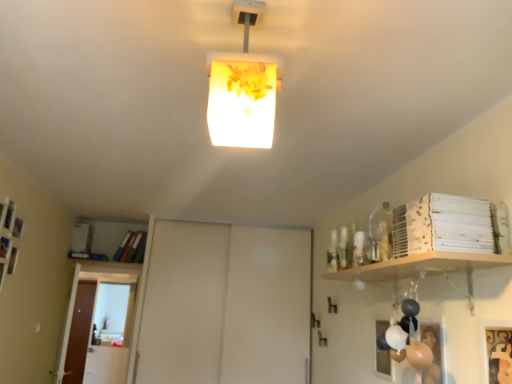
What is the approximate height of white matte sliding door at center, the 2th door from the left?

white matte sliding door at center, the 2th door from the left, is 1.54 meters in height.

Image resolution: width=512 pixels, height=384 pixels. Find the location of `white matte sliding door at center, the 2th door from the left`. white matte sliding door at center, the 2th door from the left is located at coordinates (225, 305).

Locate an element on the screen. The image size is (512, 384). transparent glass door at lower left is located at coordinates [110, 334].

The height and width of the screenshot is (384, 512). Identify the location of gold textured picture frame at lower right. (499, 355).

The width and height of the screenshot is (512, 384). I want to click on white matte sliding door at center, the 2th door from the left, so click(x=225, y=305).

Is translucent floral-patterned lampshade at center shorter than transparent glass door at lower left?

Yes, translucent floral-patterned lampshade at center is shorter than transparent glass door at lower left.

Consider the image. Which of these two, translucent floral-patterned lampshade at center or transparent glass door at lower left, is bigger?

transparent glass door at lower left is bigger.

Looking at this image, is translucent floral-patterned lampshade at center oriented away from transparent glass door at lower left?

No, translucent floral-patterned lampshade at center is not facing the opposite direction of transparent glass door at lower left.

In terms of width, does translucent floral-patterned lampshade at center look wider or thinner when compared to transparent glass door at lower left?

In the image, translucent floral-patterned lampshade at center appears to be wider than transparent glass door at lower left.

Is point (272, 271) in front of point (105, 299)?

Yes, point (272, 271) is in front of point (105, 299).

Is white matte sliding door at center, the 2th door from the left, completely or partially outside of transparent glass door at lower left?

Yes, white matte sliding door at center, the 2th door from the left, is not within transparent glass door at lower left.

Based on the photo, which of these two, white matte sliding door at center, marked as the second door in a back-to-front arrangement, or transparent glass door at lower left, is thinner?

transparent glass door at lower left is thinner.

Where is `door that is the 1st one when counting backward from the translucent floral-patterned lampshade at center`? door that is the 1st one when counting backward from the translucent floral-patterned lampshade at center is located at coordinates (225, 305).

Are white matte sliding door at center, arranged as the first door when viewed from the front, and translucent floral-patterned lampshade at center making contact?

white matte sliding door at center, arranged as the first door when viewed from the front, and translucent floral-patterned lampshade at center are clearly separated.

Considering the positions of point (183, 273) and point (249, 95), is point (183, 273) closer or farther from the camera than point (249, 95)?

Point (183, 273) is farther from the camera than point (249, 95).

From a real-world perspective, is brown wooden door at left, the first door viewed from the left, physically located above or below translucent floral-patterned lampshade at center?

In terms of real-world spatial position, brown wooden door at left, the first door viewed from the left, is below translucent floral-patterned lampshade at center.

Which object is wider, brown wooden door at left, the first door in the back-to-front sequence, or translucent floral-patterned lampshade at center?

translucent floral-patterned lampshade at center.

Is brown wooden door at left, the second door positioned from the front, aimed at translucent floral-patterned lampshade at center?

No, brown wooden door at left, the second door positioned from the front, is not turned towards translucent floral-patterned lampshade at center.

Does brown wooden door at left, the first door viewed from the left, have a greater height compared to translucent floral-patterned lampshade at center?

Yes.

Are gold textured picture frame at lower right and transparent glass door at lower left making contact?

No.

Could you tell me if gold textured picture frame at lower right is facing transparent glass door at lower left?

No, gold textured picture frame at lower right is not turned towards transparent glass door at lower left.

Considering the sizes of gold textured picture frame at lower right and transparent glass door at lower left in the image, is gold textured picture frame at lower right bigger or smaller than transparent glass door at lower left?

gold textured picture frame at lower right is smaller than transparent glass door at lower left.

Are transparent glass door at lower left and brown wooden door at left, the first door in the back-to-front sequence, located far from each other?

No.

Is transparent glass door at lower left thinner than brown wooden door at left, the first door in the back-to-front sequence?

Incorrect, the width of transparent glass door at lower left is not less than that of brown wooden door at left, the first door in the back-to-front sequence.

Considering the sizes of transparent glass door at lower left and brown wooden door at left, the second door positioned from the front, in the image, is transparent glass door at lower left taller or shorter than brown wooden door at left, the second door positioned from the front,?

transparent glass door at lower left is shorter than brown wooden door at left, the second door positioned from the front.

Considering the sizes of transparent glass door at lower left and brown wooden door at left, the 2th door positioned from the right, in the image, is transparent glass door at lower left bigger or smaller than brown wooden door at left, the 2th door positioned from the right,?

transparent glass door at lower left is bigger than brown wooden door at left, the 2th door positioned from the right.

Considering the positions of objects transparent glass door at lower left and white matte sliding door at center, arranged as the first door when viewed from the front, in the image provided, who is behind, transparent glass door at lower left or white matte sliding door at center, arranged as the first door when viewed from the front,?

transparent glass door at lower left is further away from the camera.

Is transparent glass door at lower left situated inside white matte sliding door at center, arranged as the first door when viewed from the front, or outside?

The correct answer is: outside.

What's the angular difference between transparent glass door at lower left and white matte sliding door at center, the 2th door from the left,'s facing directions?

transparent glass door at lower left and white matte sliding door at center, the 2th door from the left, are facing 8.15 degrees away from each other.

Is transparent glass door at lower left not near white matte sliding door at center, the 2th door from the left?

Indeed, transparent glass door at lower left is not near white matte sliding door at center, the 2th door from the left.

Locate an element on the screen. The height and width of the screenshot is (384, 512). lamp in front of the transparent glass door at lower left is located at coordinates (243, 88).

This screenshot has width=512, height=384. In the image, there is a white matte sliding door at center, the 2th door from the left. In order to click on glass door below it (from a real-world perspective) in this screenshot , I will do `click(110, 334)`.

From the image, which object appears to be nearer to white matte sliding door at center, the 2th door from the left, brown wooden door at left, the 2th door positioned from the right, or gold textured picture frame at lower right?

brown wooden door at left, the 2th door positioned from the right, is positioned closer to the anchor white matte sliding door at center, the 2th door from the left.

When comparing their distances from translucent floral-patterned lampshade at center, does transparent glass door at lower left or brown wooden door at left, the first door in the back-to-front sequence, seem closer?

brown wooden door at left, the first door in the back-to-front sequence, is positioned closer to the anchor translucent floral-patterned lampshade at center.

Which object lies nearer to the anchor point translucent floral-patterned lampshade at center, brown wooden door at left, the second door positioned from the front, or transparent glass door at lower left?

Based on the image, brown wooden door at left, the second door positioned from the front, appears to be nearer to translucent floral-patterned lampshade at center.

When comparing their distances from white matte sliding door at center, the 2th door from the left, does gold textured picture frame at lower right or transparent glass door at lower left seem further?

Among the two, gold textured picture frame at lower right is located further to white matte sliding door at center, the 2th door from the left.

From the image, which object appears to be nearer to translucent floral-patterned lampshade at center, white matte sliding door at center, arranged as the first door when viewed from the front, or brown wooden door at left, the second door positioned from the front?

The object closer to translucent floral-patterned lampshade at center is white matte sliding door at center, arranged as the first door when viewed from the front.

Which object lies further to the anchor point brown wooden door at left, the first door in the back-to-front sequence, transparent glass door at lower left or white matte sliding door at center, marked as the second door in a back-to-front arrangement?

Based on the image, white matte sliding door at center, marked as the second door in a back-to-front arrangement, appears to be further to brown wooden door at left, the first door in the back-to-front sequence.

When comparing their distances from translucent floral-patterned lampshade at center, does white matte sliding door at center, which is the first door from right to left, or gold textured picture frame at lower right seem closer?

Among the two, gold textured picture frame at lower right is located nearer to translucent floral-patterned lampshade at center.

Looking at the image, which one is located closer to gold textured picture frame at lower right, transparent glass door at lower left or white matte sliding door at center, the 2th door from the left?

white matte sliding door at center, the 2th door from the left, lies closer to gold textured picture frame at lower right than the other object.

The width and height of the screenshot is (512, 384). Identify the location of door positioned between translucent floral-patterned lampshade at center and transparent glass door at lower left from near to far. (225, 305).

Locate an element on the screen. The height and width of the screenshot is (384, 512). picture frame located between translucent floral-patterned lampshade at center and brown wooden door at left, the second door positioned from the front, in the depth direction is located at coordinates (499, 355).

What are the coordinates of `glass door between gold textured picture frame at lower right and brown wooden door at left, the first door in the back-to-front sequence, in the front-back direction` in the screenshot? It's located at (110, 334).

Where is `glass door between white matte sliding door at center, which is the first door from right to left, and brown wooden door at left, the first door in the back-to-front sequence, in the front-back direction`? The height and width of the screenshot is (384, 512). glass door between white matte sliding door at center, which is the first door from right to left, and brown wooden door at left, the first door in the back-to-front sequence, in the front-back direction is located at coordinates (110, 334).